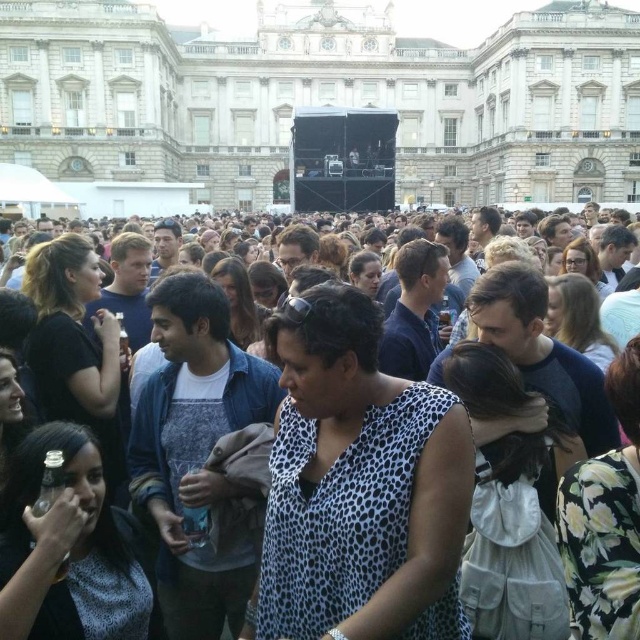
Between point (508, 54) and point (140, 385), which one is positioned in front?

Point (140, 385) is more forward.

The height and width of the screenshot is (640, 640). What do you see at coordinates (323, 99) in the screenshot? I see `white stone building at center` at bounding box center [323, 99].

Image resolution: width=640 pixels, height=640 pixels. I want to click on white stone building at center, so click(323, 99).